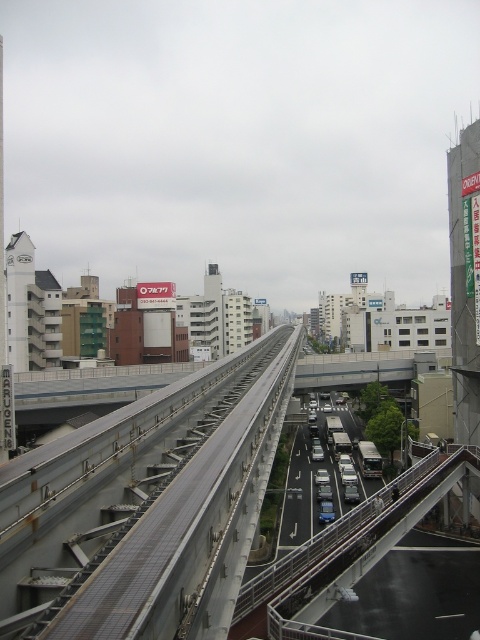
You are standing in the urban scene and want to take a photo of both point (345, 554) and point (315, 472). Since you want both points to be in focus, which point should you focus on to ensure both are sharp?

You should focus on point (345, 554) because it is closer to the camera. By focusing on the closer point, the farther point (315, 472) will still be within the depth of field, ensuring both are in focus.

You are a pedestrian standing on the sidewalk and see the metallic gray train track at center and the metallic blue sedan at center. Which object is above the other?

The metallic gray train track at center is positioned over the metallic blue sedan at center, so the train track is above the sedan.

You are standing at the monorail track and looking towards the multi story building with a white tower. There are two points marked on the ground in front of you. The first point is at coordinate point (x=182, y=552) and the second point is at coordinate point (x=317, y=468). Which point is closer to you?

Point (x=182, y=552) is in front of point (x=317, y=468), so it is closer to you.